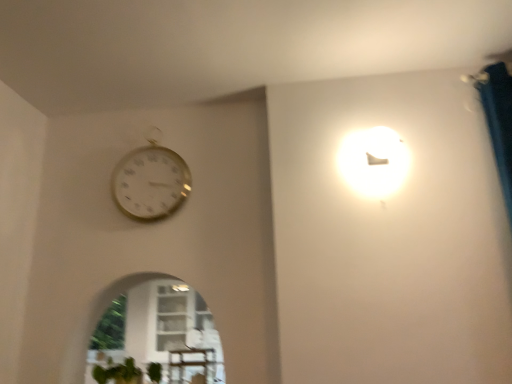
Question: Can green matte plant at lower left be found inside wooden table at lower center?

Choices:
 (A) no
 (B) yes

Answer: (A)

Question: Is wooden table at lower center closer to camera compared to green matte plant at lower left?

Choices:
 (A) yes
 (B) no

Answer: (B)

Question: From a real-world perspective, is wooden table at lower center beneath green matte plant at lower left?

Choices:
 (A) yes
 (B) no

Answer: (B)

Question: From the image's perspective, is wooden table at lower center on green matte plant at lower left?

Choices:
 (A) no
 (B) yes

Answer: (B)

Question: Does wooden table at lower center turn towards green matte plant at lower left?

Choices:
 (A) yes
 (B) no

Answer: (B)

Question: Is point (176, 349) positioned closer to the camera than point (121, 382)?

Choices:
 (A) closer
 (B) farther

Answer: (A)

Question: From their relative heights in the image, would you say wooden table at lower center is taller or shorter than green matte plant at lower left?

Choices:
 (A) tall
 (B) short

Answer: (A)

Question: Would you say wooden table at lower center is to the left or to the right of green matte plant at lower left in the picture?

Choices:
 (A) left
 (B) right

Answer: (B)

Question: From a real-world perspective, is wooden table at lower center above or below green matte plant at lower left?

Choices:
 (A) below
 (B) above

Answer: (B)

Question: From their relative heights in the image, would you say gold metallic wall clock at upper left is taller or shorter than green matte plant at lower left?

Choices:
 (A) short
 (B) tall

Answer: (B)

Question: Is gold metallic wall clock at upper left in front of or behind green matte plant at lower left in the image?

Choices:
 (A) behind
 (B) front

Answer: (A)

Question: From a real-world perspective, relative to green matte plant at lower left, is gold metallic wall clock at upper left vertically above or below?

Choices:
 (A) above
 (B) below

Answer: (A)

Question: From the image's perspective, is gold metallic wall clock at upper left positioned above or below green matte plant at lower left?

Choices:
 (A) above
 (B) below

Answer: (A)

Question: Looking at their shapes, would you say wooden table at lower center is wider or thinner than gold metallic wall clock at upper left?

Choices:
 (A) thin
 (B) wide

Answer: (B)

Question: From the image's perspective, relative to gold metallic wall clock at upper left, is wooden table at lower center above or below?

Choices:
 (A) above
 (B) below

Answer: (B)